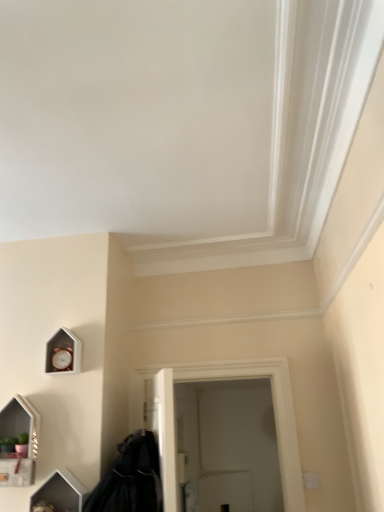
Question: Is wooden clock at lower left closer to the viewer compared to matte white medicine cabinet at lower left?

Choices:
 (A) yes
 (B) no

Answer: (B)

Question: From the image's perspective, is wooden clock at lower left above matte white medicine cabinet at lower left?

Choices:
 (A) yes
 (B) no

Answer: (A)

Question: Is the surface of wooden clock at lower left in direct contact with matte white medicine cabinet at lower left?

Choices:
 (A) yes
 (B) no

Answer: (B)

Question: Considering the relative sizes of wooden clock at lower left and matte white medicine cabinet at lower left in the image provided, is wooden clock at lower left taller than matte white medicine cabinet at lower left?

Choices:
 (A) no
 (B) yes

Answer: (A)

Question: Is wooden clock at lower left shorter than matte white medicine cabinet at lower left?

Choices:
 (A) no
 (B) yes

Answer: (B)

Question: Is white matte door at center taller or shorter than wooden clock at lower left?

Choices:
 (A) short
 (B) tall

Answer: (B)

Question: Is white matte door at center spatially inside wooden clock at lower left, or outside of it?

Choices:
 (A) inside
 (B) outside

Answer: (B)

Question: Considering their positions, is white matte door at center located in front of or behind wooden clock at lower left?

Choices:
 (A) behind
 (B) front

Answer: (A)

Question: Considering the positions of white matte door at center and wooden clock at lower left in the image, is white matte door at center wider or thinner than wooden clock at lower left?

Choices:
 (A) wide
 (B) thin

Answer: (B)

Question: Considering the positions of wooden clock at lower left and matte white medicine cabinet at lower left in the image, is wooden clock at lower left bigger or smaller than matte white medicine cabinet at lower left?

Choices:
 (A) big
 (B) small

Answer: (B)

Question: From the image's perspective, relative to matte white medicine cabinet at lower left, is wooden clock at lower left above or below?

Choices:
 (A) above
 (B) below

Answer: (A)

Question: Is point (79, 366) closer or farther from the camera than point (1, 433)?

Choices:
 (A) closer
 (B) farther

Answer: (B)

Question: Considering the positions of wooden clock at lower left and matte white medicine cabinet at lower left in the image, is wooden clock at lower left wider or thinner than matte white medicine cabinet at lower left?

Choices:
 (A) thin
 (B) wide

Answer: (A)

Question: From a real-world perspective, relative to black matte coat at lower left, is white matte door at center vertically above or below?

Choices:
 (A) above
 (B) below

Answer: (A)

Question: Do you think white matte door at center is within black matte coat at lower left, or outside of it?

Choices:
 (A) outside
 (B) inside

Answer: (A)